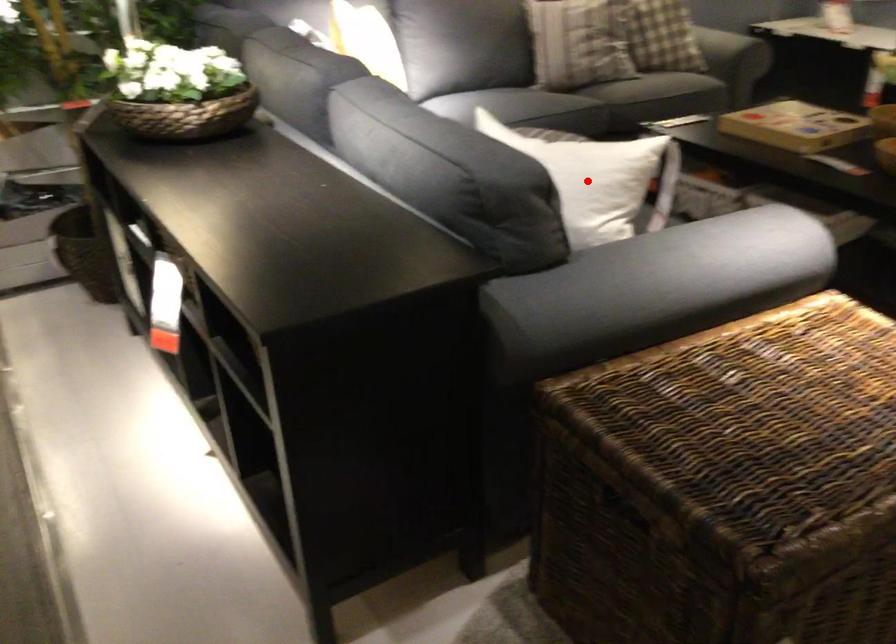
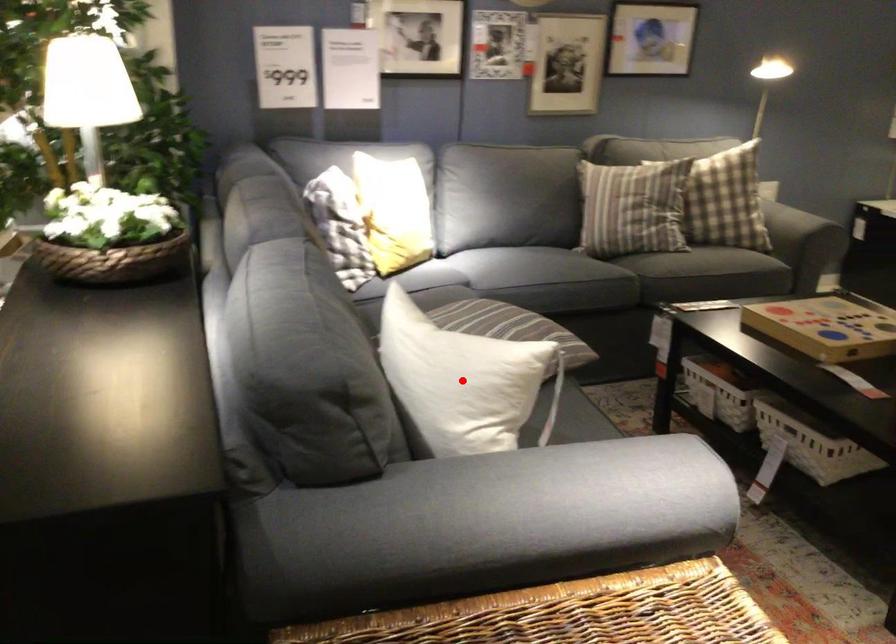
I am providing you with two images of the same scene from different viewpoints. A red point is marked on the first image and another point is marked on the second image. Do the highlighted points in image1 and image2 indicate the same real-world spot?

Yes